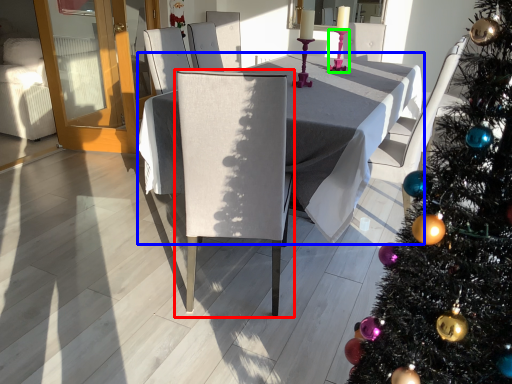
Question: Based on their relative distances, which object is nearer to chair (highlighted by a red box)? Choose from table (highlighted by a blue box) and candle holder (highlighted by a green box).

Choices:
 (A) table
 (B) candle holder

Answer: (A)